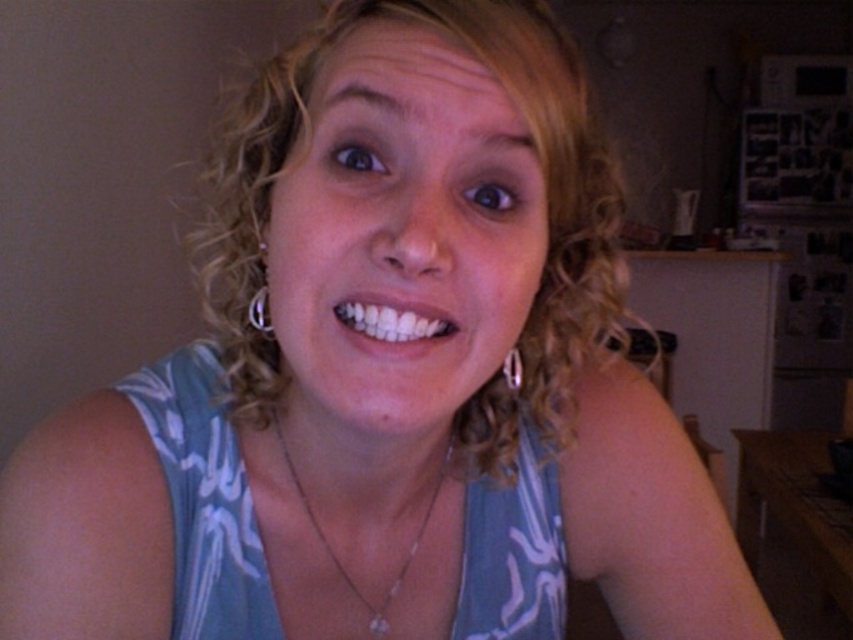
Question: Among these points, which one is nearest to the camera?

Choices:
 (A) (415, 540)
 (B) (381, 36)
 (C) (577, 100)
 (D) (200, 426)

Answer: (B)

Question: Can you confirm if blue printed fabric dress at center is positioned above silver chain necklace at center?

Choices:
 (A) no
 (B) yes

Answer: (A)

Question: Is curly blonde hair at center behind white glossy teeth at center?

Choices:
 (A) no
 (B) yes

Answer: (B)

Question: Which of these objects is positioned farthest from the white glossy teeth at center?

Choices:
 (A) matte skin face at center
 (B) curly blonde hair at center

Answer: (B)

Question: Which point is farther to the camera?

Choices:
 (A) (349, 417)
 (B) (343, 577)
 (C) (248, 364)
 (D) (204, 508)

Answer: (B)

Question: Is curly blonde hair at center in front of white glossy teeth at center?

Choices:
 (A) yes
 (B) no

Answer: (B)